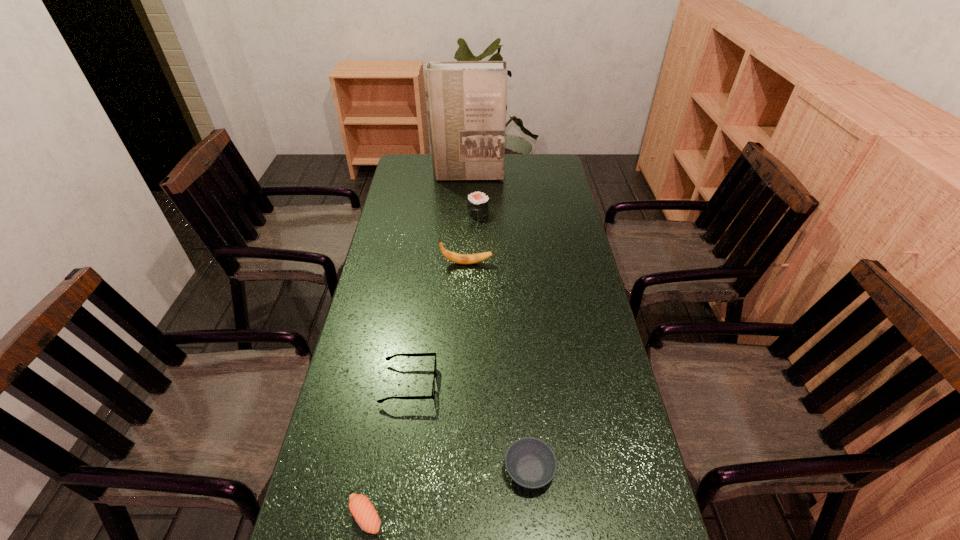
Find the location of a particular element. free spot located on the cover of the phonebook is located at coordinates (467, 221).

You are a GUI agent. You are given a task and a screenshot of the screen. Output one action in this format:
    pyautogui.click(x=<x>, y=<y>)
    Task: Click on the free spot located on the peel of the fifth shortest object from the top
    
    Given the screenshot: What is the action you would take?
    pyautogui.click(x=537, y=264)

What are the coordinates of `vacant space located 0.150m on the front of the fourth shortest object` in the screenshot? It's located at (478, 244).

Image resolution: width=960 pixels, height=540 pixels. What are the coordinates of `free space located on the right of the shorter sushi` in the screenshot? It's located at (418, 516).

At what (x,y) coordinates should I click in order to perform the action: click on vacant region located on the arms of the third nearest object. Please return your answer as a coordinate pair (x, y). The image size is (960, 540). Looking at the image, I should click on (565, 384).

I want to click on free location located on the left of the soup bowl, so click(407, 470).

Where is `object located in the far edge section of the desktop`? This screenshot has width=960, height=540. object located in the far edge section of the desktop is located at coordinates (466, 100).

The image size is (960, 540). What are the coordinates of `phonebook present at the left edge` in the screenshot? It's located at (466, 100).

Find the location of `sushi at the left edge`. sushi at the left edge is located at coordinates (361, 508).

The height and width of the screenshot is (540, 960). Find the location of `spectacles that is at the left edge`. spectacles that is at the left edge is located at coordinates (408, 354).